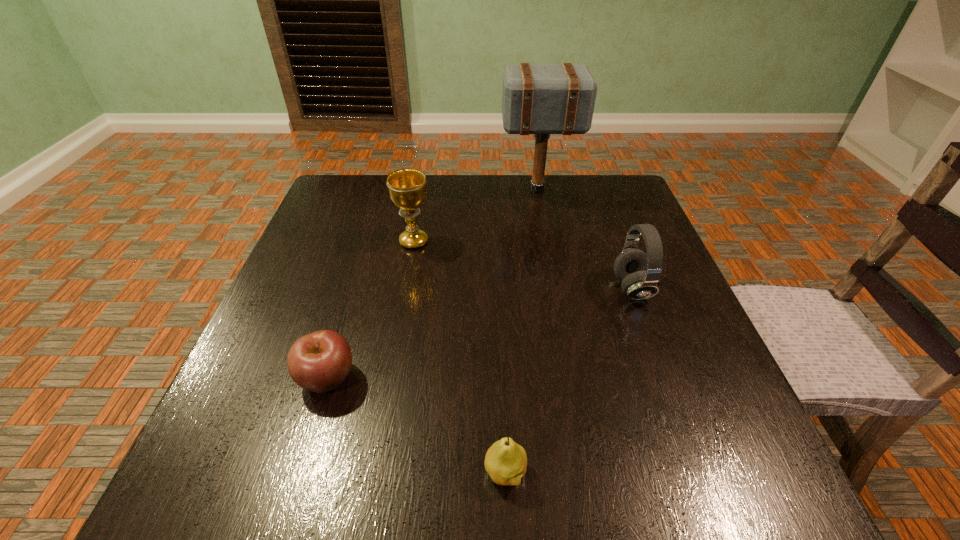
This screenshot has width=960, height=540. Find the location of `vacant position located 0.060m on the striking surface of the mallet`. vacant position located 0.060m on the striking surface of the mallet is located at coordinates (478, 190).

The image size is (960, 540). Identify the location of free location located 0.060m on the striking surface of the mallet. (478, 190).

Locate an element on the screen. The width and height of the screenshot is (960, 540). vacant space located on the back of the chalice is located at coordinates pos(420,208).

This screenshot has height=540, width=960. Find the location of `vacant space located on the ear cups of the headset`. vacant space located on the ear cups of the headset is located at coordinates (513, 289).

Image resolution: width=960 pixels, height=540 pixels. I want to click on vacant space situated on the ear cups of the headset, so click(517, 289).

Locate an element on the screen. Image resolution: width=960 pixels, height=540 pixels. free space located on the ear cups of the headset is located at coordinates (427, 289).

This screenshot has width=960, height=540. Identify the location of free space located 0.200m on the right of the nearest object. (664, 472).

Identify the location of vacant point located 0.080m on the side of the leftmost object with the unique marking. This screenshot has height=540, width=960. (403, 377).

Identify the location of object located in the far edge section of the desktop. (536, 99).

The image size is (960, 540). In order to click on object present at the near edge in this screenshot , I will do `click(505, 461)`.